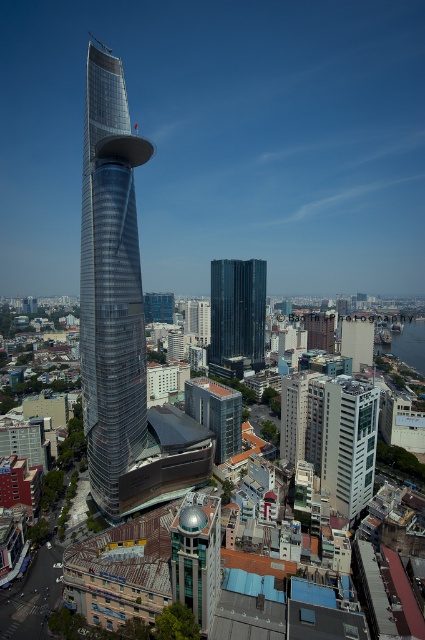
You are a city planner analyzing the urban layout. Given the white glass building at center and the black glass tower at center, which structure would require more land area for its foundation?

The black glass tower at center requires more land area for its foundation because it occupies more space than the white glass building at center.

You are a drone operator tasked with flying a drone between the shiny glass tower at center and the white glass building at center. The drone has a maximum flight distance of 200 feet. Can the drone safely travel between these two structures without exceeding its range?

The shiny glass tower at center and the white glass building at center are 235.54 feet apart from each other. Since the drone has a maximum flight distance of 200 feet, it cannot safely travel between them without exceeding its range.